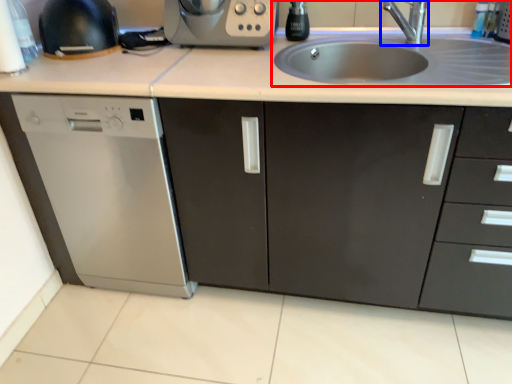
Question: Which object is closer to the camera taking this photo, sink (highlighted by a red box) or tap (highlighted by a blue box)?

Choices:
 (A) sink
 (B) tap

Answer: (A)